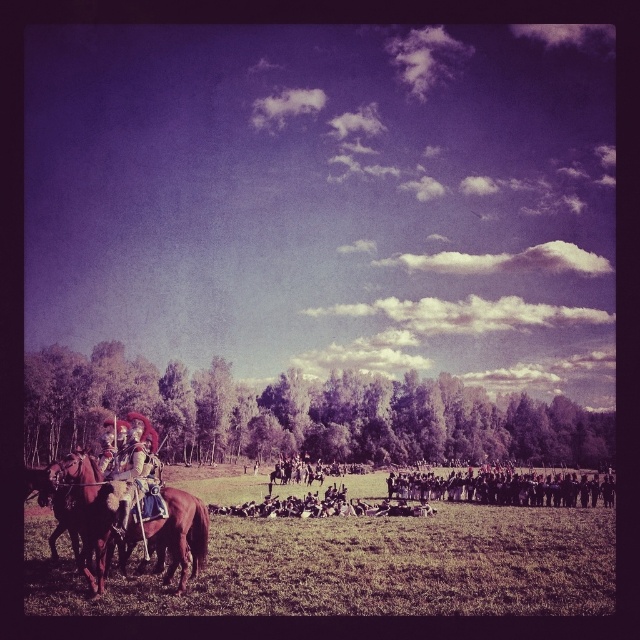
Is green grass at center wider than brown leather horse at left?

Correct, the width of green grass at center exceeds that of brown leather horse at left.

Does green grass at center come behind brown leather horse at left?

No, it is in front of brown leather horse at left.

Is point (280, 614) positioned behind point (164, 528)?

No, it is in front of (164, 528).

This screenshot has width=640, height=640. Identify the location of green grass at center. [x=360, y=566].

Based on the photo, can you confirm if black uniformed soldiers at center is smaller than brown leather horse at lower left?

Actually, black uniformed soldiers at center might be larger than brown leather horse at lower left.

Who is lower down, black uniformed soldiers at center or brown leather horse at lower left?

Positioned lower is black uniformed soldiers at center.

Who is more distant from viewer, (x=508, y=481) or (x=52, y=532)?

Point (x=508, y=481)

In order to click on black uniformed soldiers at center in this screenshot , I will do `click(506, 486)`.

Between green grass at center and shiny gold armor at left, which one is positioned higher?

shiny gold armor at left

Can you confirm if green grass at center is smaller than shiny gold armor at left?

Incorrect, green grass at center is not smaller in size than shiny gold armor at left.

In order to click on green grass at center in this screenshot , I will do `click(360, 566)`.